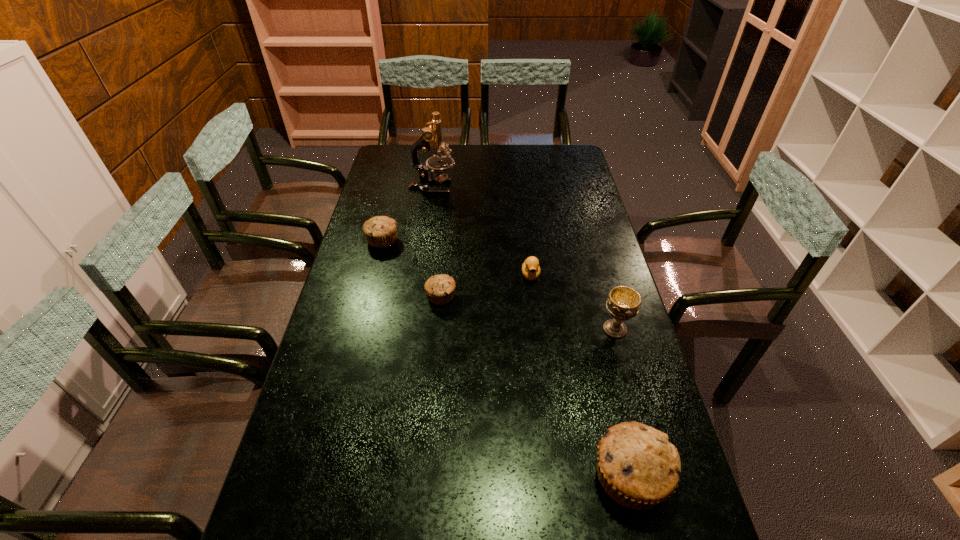
This screenshot has width=960, height=540. Find the location of `vacant spot for a new muffin to ensure equal spacing`. vacant spot for a new muffin to ensure equal spacing is located at coordinates point(519,372).